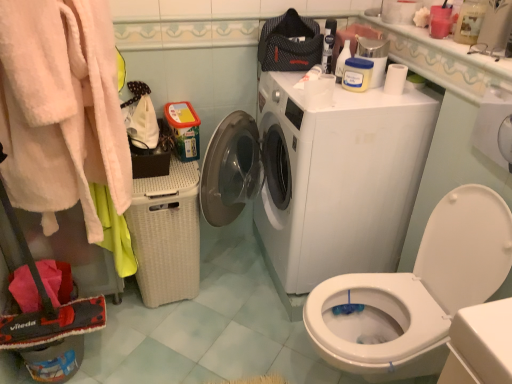
This screenshot has width=512, height=384. What are the coordinates of `free spot below fluffy pink bathrobe at left (from a real-world perspective)` in the screenshot? It's located at (122, 341).